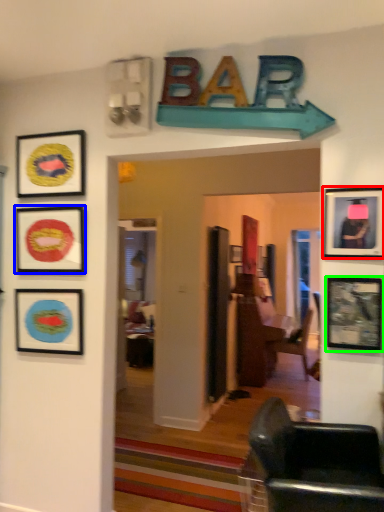
Question: Which object is positioned closest to picture frame (highlighted by a red box)? Select from picture frame (highlighted by a blue box) and picture frame (highlighted by a green box).

Choices:
 (A) picture frame
 (B) picture frame

Answer: (B)